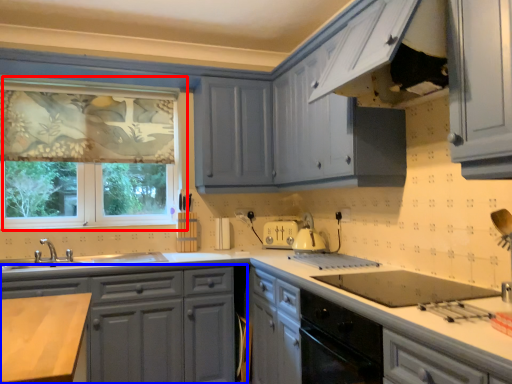
Question: Which object appears farthest to the camera in this image, window (highlighted by a red box) or cabinetry (highlighted by a blue box)?

Choices:
 (A) window
 (B) cabinetry

Answer: (A)